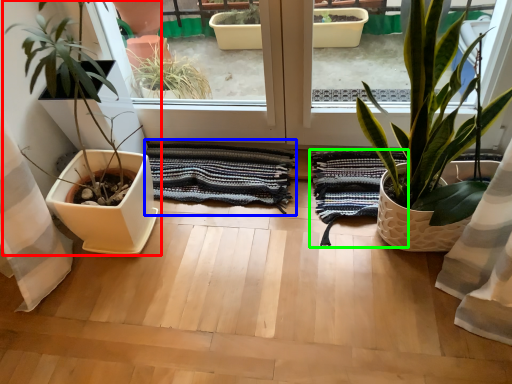
Question: Based on their relative distances, which object is nearer to houseplant (highlighted by a red box)? Choose from bath towel (highlighted by a blue box) and bath towel (highlighted by a green box).

Choices:
 (A) bath towel
 (B) bath towel

Answer: (A)